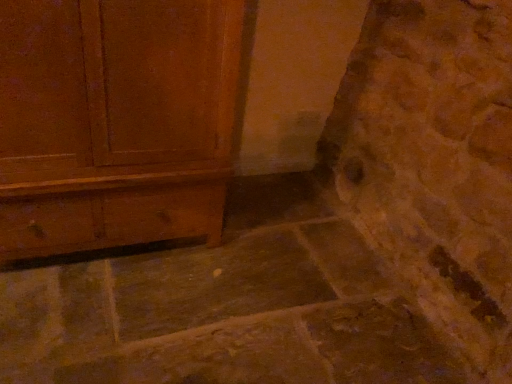
Locate an element on the screen. This screenshot has width=512, height=384. free space in front of matte wood chest of drawers at left is located at coordinates tap(97, 319).